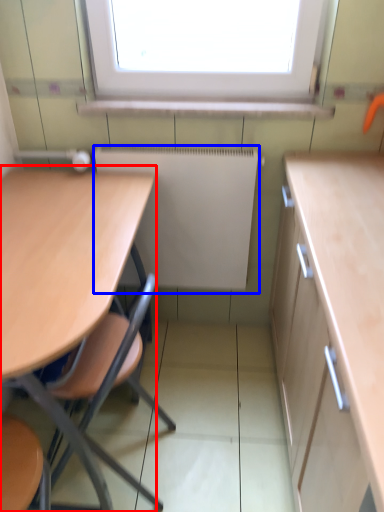
Question: Which of the following is the farthest to the observer, table (highlighted by a red box) or radiator (highlighted by a blue box)?

Choices:
 (A) table
 (B) radiator

Answer: (B)